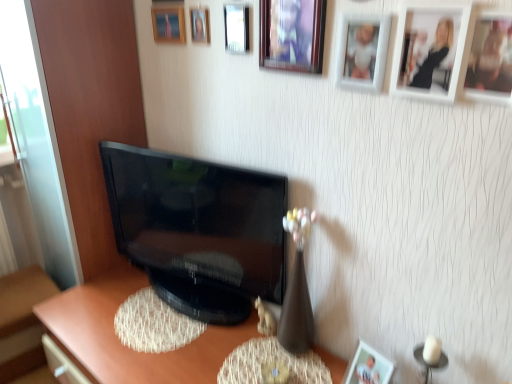
Where is `empty space that is ontop of matte brown desk at center`? This screenshot has height=384, width=512. empty space that is ontop of matte brown desk at center is located at coordinates (165, 334).